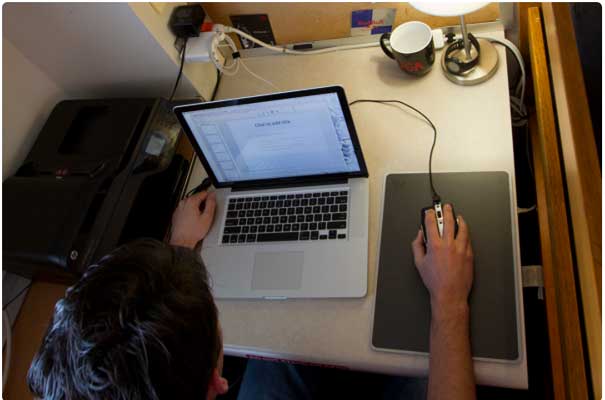
Find the location of a particular element. table lamp is located at coordinates (460, 8).